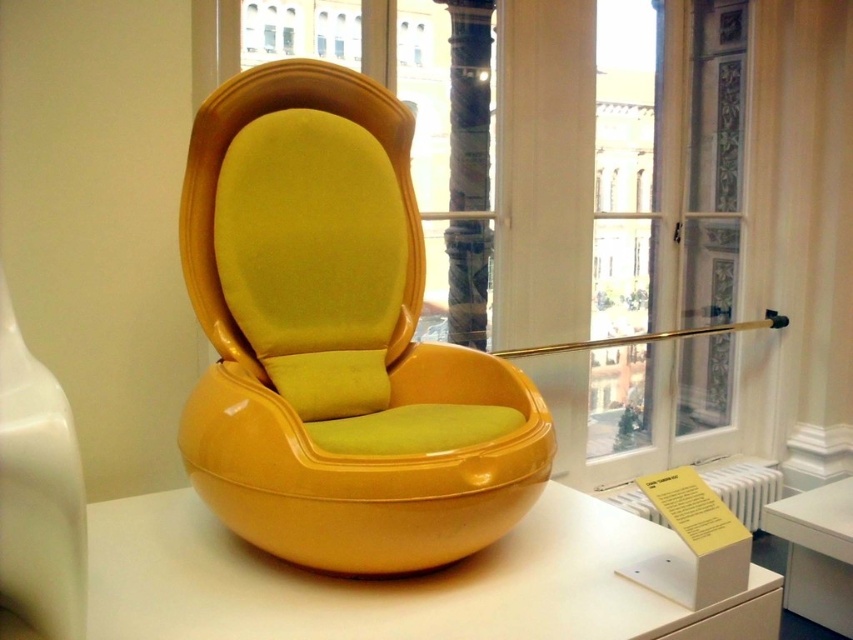
Who is shorter, glossy yellow chair at center or glossy yellow bowl at center?

With less height is glossy yellow bowl at center.

Between glossy yellow chair at center and glossy yellow bowl at center, which one appears on the right side from the viewer's perspective?

From the viewer's perspective, glossy yellow bowl at center appears more on the right side.

At what (x,y) coordinates should I click in order to perform the action: click on glossy yellow chair at center. Please return your answer as a coordinate pair (x, y). The image size is (853, 640). Looking at the image, I should click on (335, 340).

Can you confirm if glossy yellow bowl at center is taller than matte white table at center?

No.

Who is more distant from viewer, (292,573) or (793,584)?

The point (793,584) is more distant.

The height and width of the screenshot is (640, 853). I want to click on glossy yellow bowl at center, so click(399, 582).

Does glossy yellow chair at center have a lesser width compared to matte white table at center?

No.

Identify the location of glossy yellow chair at center. The width and height of the screenshot is (853, 640). (335, 340).

At what (x,y) coordinates should I click in order to perform the action: click on glossy yellow chair at center. Please return your answer as a coordinate pair (x, y). The width and height of the screenshot is (853, 640). Looking at the image, I should click on (335, 340).